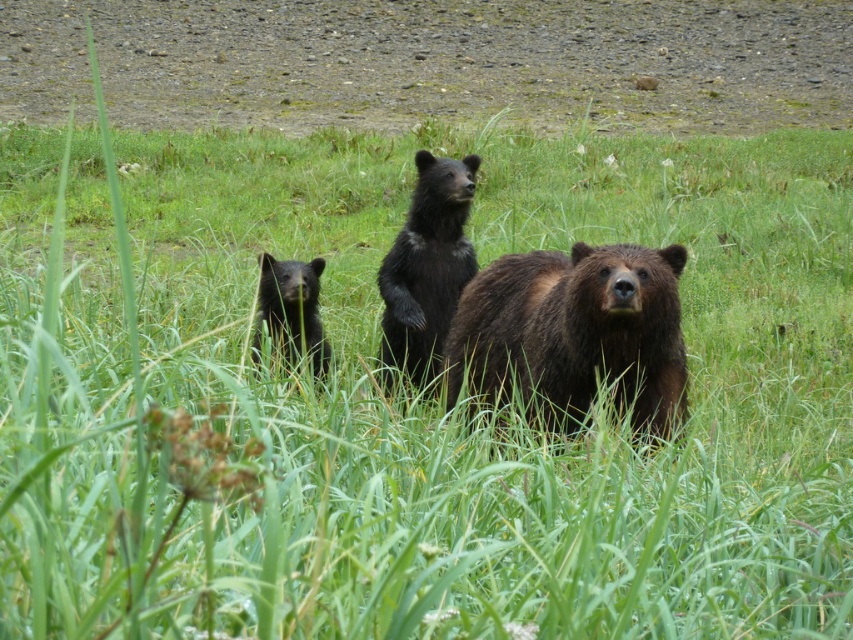
Is black fur bear at center shorter than black fuzzy bear cub at center?

In fact, black fur bear at center may be taller than black fuzzy bear cub at center.

Does black fur bear at center have a larger size compared to black fuzzy bear cub at center?

Yes, black fur bear at center is bigger than black fuzzy bear cub at center.

Who is more forward, (438, 260) or (312, 298)?

Point (312, 298) is in front.

The height and width of the screenshot is (640, 853). I want to click on black fur bear at center, so click(426, 268).

Is brown furry bear at center shorter than black fur bear at center?

Yes, brown furry bear at center is shorter than black fur bear at center.

At what (x,y) coordinates should I click in order to perform the action: click on brown furry bear at center. Please return your answer as a coordinate pair (x, y). Looking at the image, I should click on (575, 332).

Can you confirm if brown furry bear at center is smaller than black fuzzy bear cub at center?

Actually, brown furry bear at center might be larger than black fuzzy bear cub at center.

Where is `brown furry bear at center`? The height and width of the screenshot is (640, 853). brown furry bear at center is located at coordinates (575, 332).

You are a GUI agent. You are given a task and a screenshot of the screen. Output one action in this format:
    pyautogui.click(x=<x>, y=<y>)
    Task: Click on the brown furry bear at center
    
    Given the screenshot: What is the action you would take?
    pyautogui.click(x=575, y=332)